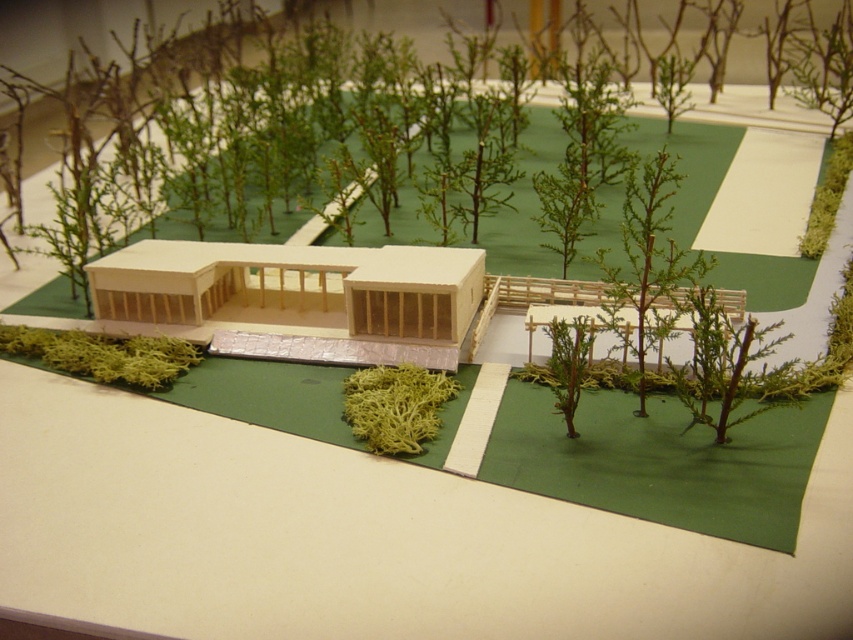
Does point (645, 388) come farther from viewer compared to point (700, 353)?

Yes, it is behind point (700, 353).

Which of these two, green matte tree at center-right or green matte tree at lower right, stands shorter?

green matte tree at lower right is shorter.

Between point (643, 205) and point (778, 371), which one is positioned in front?

Point (778, 371)

The image size is (853, 640). In order to click on green matte tree at center-right in this screenshot , I will do `click(648, 250)`.

The image size is (853, 640). Describe the element at coordinates (724, 365) in the screenshot. I see `green matte tree at lower right` at that location.

Does green matte tree at lower right appear on the left side of green moss at lower left?

Incorrect, green matte tree at lower right is not on the left side of green moss at lower left.

The height and width of the screenshot is (640, 853). I want to click on green matte tree at lower right, so click(x=724, y=365).

Who is positioned more to the right, green matte tree at center-right or green moss at lower left?

green matte tree at center-right is more to the right.

Is green matte tree at center-right bigger than green moss at lower left?

Yes, green matte tree at center-right is bigger than green moss at lower left.

Is point (631, 256) more distant than point (30, 336)?

No, (631, 256) is closer to viewer.

Image resolution: width=853 pixels, height=640 pixels. What are the coordinates of `green matte tree at center-right` in the screenshot? It's located at (648, 250).